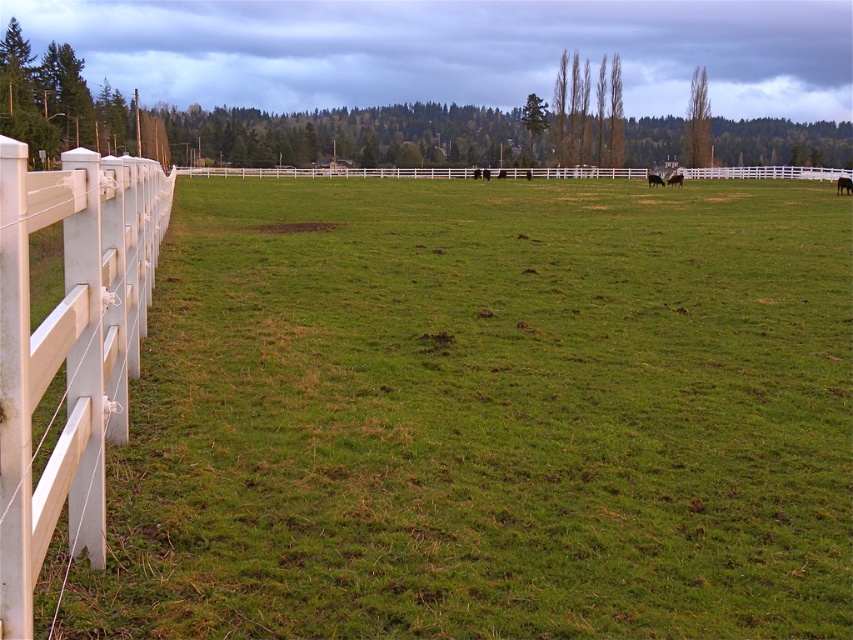
Is white plastic fence at center shorter than brown glossy horse at center-right?

No.

This screenshot has width=853, height=640. I want to click on white plastic fence at center, so click(x=326, y=172).

Consider the image. Who is more forward, (697, 179) or (648, 172)?

Point (648, 172)

The height and width of the screenshot is (640, 853). I want to click on white plastic fence at center, so click(326, 172).

Does point (647, 177) come closer to viewer compared to point (670, 180)?

No.

Is point (659, 179) farther from viewer compared to point (669, 180)?

No, (659, 179) is in front of (669, 180).

Identify the location of brown glossy horse at center-right. This screenshot has height=640, width=853. (654, 179).

Which is in front, point (756, 170) or point (679, 182)?

Point (679, 182)

Is white plastic fence at center taller than black glossy horse at center?

Indeed, white plastic fence at center has a greater height compared to black glossy horse at center.

Is point (573, 168) closer to camera compared to point (677, 177)?

No.

What are the coordinates of `white plastic fence at center` in the screenshot? It's located at (326, 172).